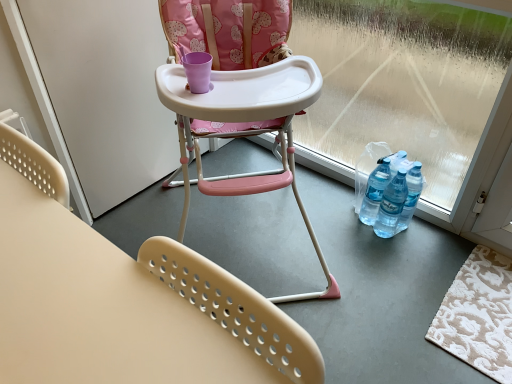
What are the coordinates of `vacant space underneath beige textured rug at lower right (from a real-world perspective)` in the screenshot? It's located at pyautogui.click(x=480, y=307).